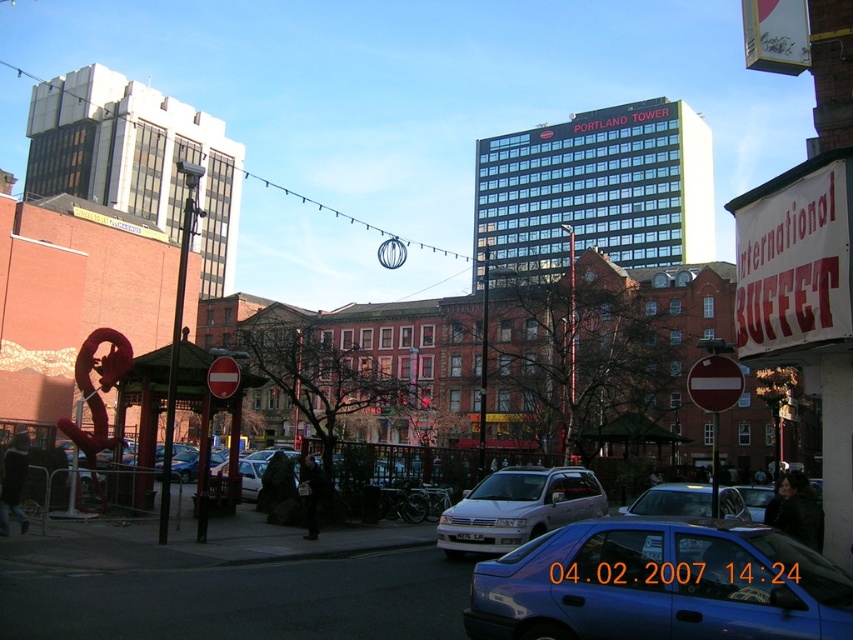
Question: Estimate the real-world distances between objects in this image. Which object is farther from the metallic wire clock at center?

Choices:
 (A) white matte suv at center
 (B) blue metallic car at center

Answer: (B)

Question: Observing the image, what is the correct spatial positioning of blue metallic car at center in reference to metallic wire clock at center?

Choices:
 (A) above
 (B) below

Answer: (B)

Question: Which point is closer to the camera?

Choices:
 (A) (x=403, y=244)
 (B) (x=833, y=572)

Answer: (B)

Question: From the image, what is the correct spatial relationship of white matte suv at center in relation to metallic blue sedan at center?

Choices:
 (A) below
 (B) above

Answer: (B)

Question: Estimate the real-world distances between objects in this image. Which object is farther from the blue metallic car at center?

Choices:
 (A) metallic wire clock at center
 (B) white matte suv at center
 (C) metallic blue sedan at center

Answer: (A)

Question: Does white matte suv at center have a smaller size compared to metallic wire clock at center?

Choices:
 (A) no
 (B) yes

Answer: (B)